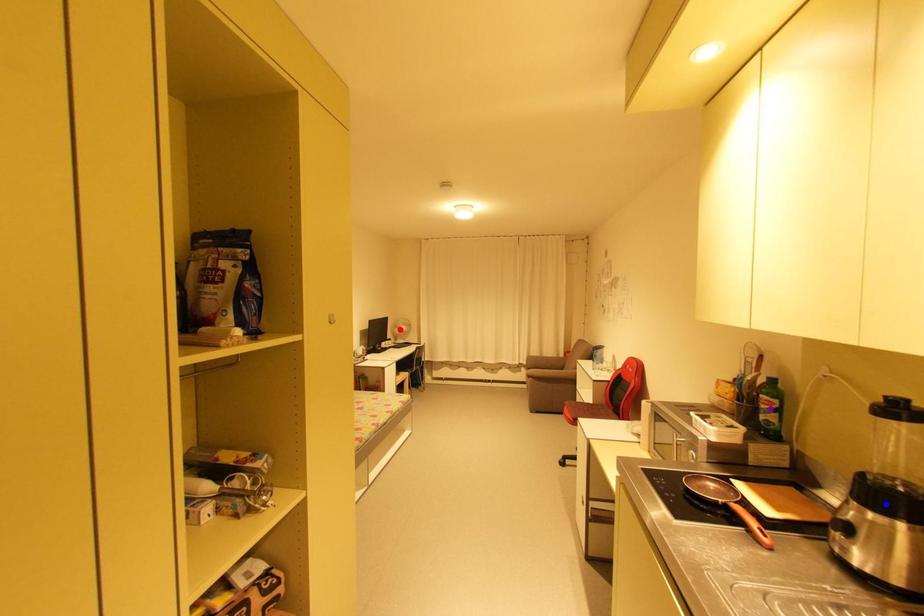
Order these from farthest to nearest:
red point
blue point
purple point

red point < purple point < blue point